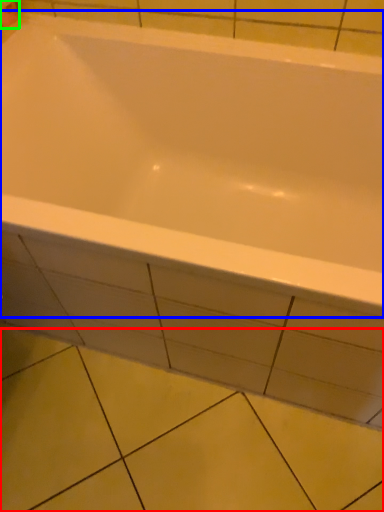
Question: Considering the real-world distances, which object is closest to ceramic tile (highlighted by a red box)? bathtub (highlighted by a blue box) or toilet paper (highlighted by a green box).

Choices:
 (A) bathtub
 (B) toilet paper

Answer: (A)